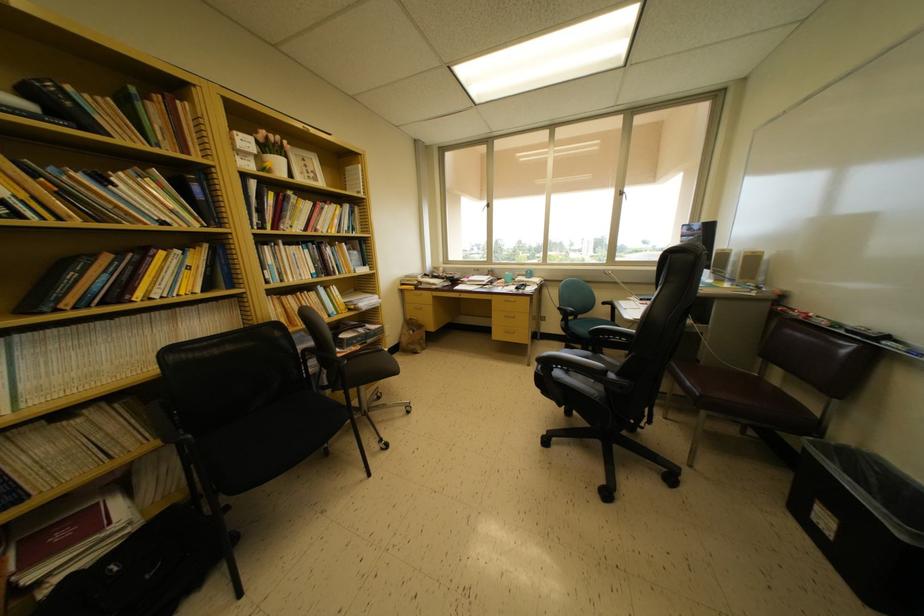
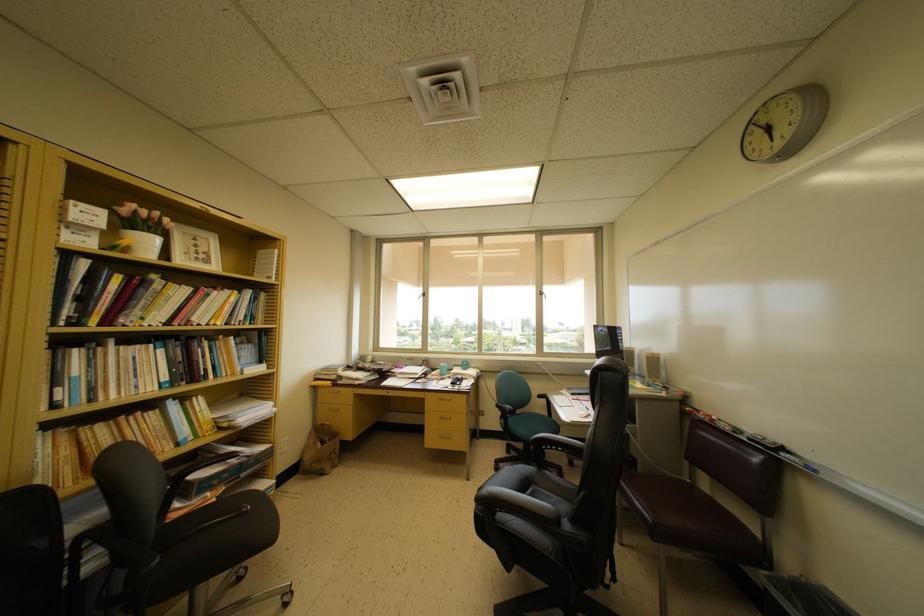
In a continuous first-person perspective shot, in which direction is the camera moving?

The cameraman moved toward right, forward.